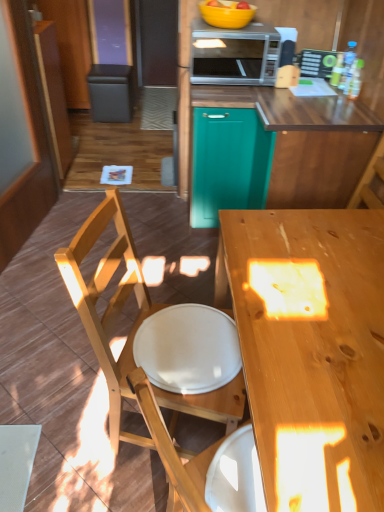
Question: Does wooden desk at center appear on the left side of wooden countertop at center?

Choices:
 (A) yes
 (B) no

Answer: (B)

Question: Is wooden desk at center to the right of wooden countertop at center from the viewer's perspective?

Choices:
 (A) yes
 (B) no

Answer: (A)

Question: Does wooden desk at center have a larger size compared to wooden countertop at center?

Choices:
 (A) no
 (B) yes

Answer: (B)

Question: Is wooden desk at center placed right next to wooden countertop at center?

Choices:
 (A) yes
 (B) no

Answer: (B)

Question: Is wooden desk at center positioned in front of wooden countertop at center?

Choices:
 (A) no
 (B) yes

Answer: (B)

Question: From the image's perspective, is wooden desk at center on wooden countertop at center?

Choices:
 (A) no
 (B) yes

Answer: (A)

Question: Does black leather trash bin/can at upper left have a smaller size compared to white matte plate at center?

Choices:
 (A) no
 (B) yes

Answer: (A)

Question: Can you see black leather trash bin/can at upper left touching white matte plate at center?

Choices:
 (A) yes
 (B) no

Answer: (B)

Question: From a real-world perspective, is black leather trash bin/can at upper left positioned over white matte plate at center based on gravity?

Choices:
 (A) no
 (B) yes

Answer: (A)

Question: Does black leather trash bin/can at upper left have a lesser height compared to white matte plate at center?

Choices:
 (A) yes
 (B) no

Answer: (B)

Question: Is black leather trash bin/can at upper left far from white matte plate at center?

Choices:
 (A) yes
 (B) no

Answer: (A)

Question: Can white matte plate at center be found inside black leather trash bin/can at upper left?

Choices:
 (A) no
 (B) yes

Answer: (A)

Question: Can you confirm if teal matte cabinet at center is shorter than silver metallic microwave at upper center?

Choices:
 (A) yes
 (B) no

Answer: (B)